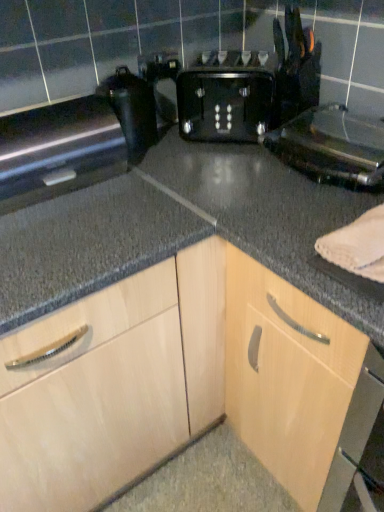
Question: Does light wood cabinet at center lie behind satin black oven at left, the 1th appliance viewed from the left?

Choices:
 (A) no
 (B) yes

Answer: (A)

Question: From a real-world perspective, is light wood cabinet at center below satin black oven at left, the third appliance from the right?

Choices:
 (A) no
 (B) yes

Answer: (B)

Question: Considering the relative sizes of light wood cabinet at center and satin black oven at left, the 1th appliance viewed from the left, in the image provided, is light wood cabinet at center shorter than satin black oven at left, the 1th appliance viewed from the left,?

Choices:
 (A) no
 (B) yes

Answer: (A)

Question: Is light wood cabinet at center facing away from satin black oven at left, the 1th appliance viewed from the left?

Choices:
 (A) no
 (B) yes

Answer: (A)

Question: Does light wood cabinet at center touch satin black oven at left, the third appliance from the right?

Choices:
 (A) yes
 (B) no

Answer: (B)

Question: Is light wood cabinet at center at the left side of satin black oven at left, the 1th appliance viewed from the left?

Choices:
 (A) yes
 (B) no

Answer: (B)

Question: Is black plastic toaster at upper center, marked as the third appliance in a left-to-right arrangement, oriented towards light wood cabinet at center?

Choices:
 (A) no
 (B) yes

Answer: (A)

Question: Could light wood cabinet at center be considered to be inside black plastic toaster at upper center, marked as the third appliance in a left-to-right arrangement?

Choices:
 (A) no
 (B) yes

Answer: (A)

Question: Is the depth of black plastic toaster at upper center, marked as the third appliance in a left-to-right arrangement, greater than that of light wood cabinet at center?

Choices:
 (A) yes
 (B) no

Answer: (A)

Question: Can we say black plastic toaster at upper center, marked as the third appliance in a left-to-right arrangement, lies outside light wood cabinet at center?

Choices:
 (A) no
 (B) yes

Answer: (B)

Question: Is black plastic toaster at upper center, marked as the third appliance in a left-to-right arrangement, looking in the opposite direction of light wood cabinet at center?

Choices:
 (A) no
 (B) yes

Answer: (A)

Question: From a real-world perspective, is black plastic toaster at upper center, marked as the 1th appliance in a right-to-left arrangement, below light wood cabinet at center?

Choices:
 (A) no
 (B) yes

Answer: (A)

Question: Can you confirm if satin black oven at left, the 1th appliance viewed from the left, is positioned to the left of black plastic toaster at center?

Choices:
 (A) yes
 (B) no

Answer: (A)